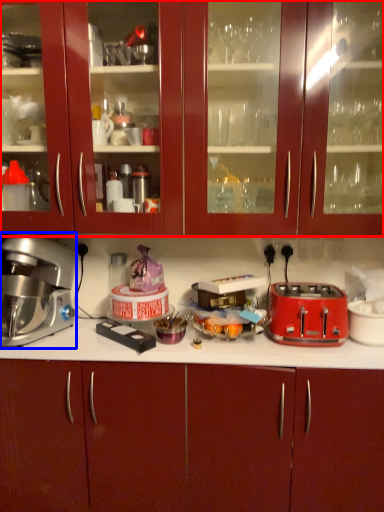
Question: Which point is further to the camera, cabinetry (highlighted by a red box) or home appliance (highlighted by a blue box)?

Choices:
 (A) cabinetry
 (B) home appliance

Answer: (B)